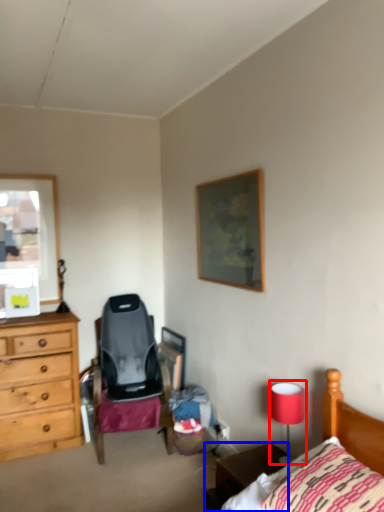
Question: Which object is further to the camera taking this photo, table lamp (highlighted by a red box) or nightstand (highlighted by a blue box)?

Choices:
 (A) table lamp
 (B) nightstand

Answer: (A)